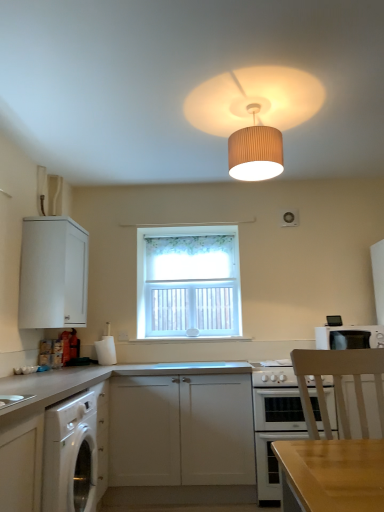
Where is `blank area beneath white glossy exhaust hood at upper center (from a real-world perspective)`? The width and height of the screenshot is (384, 512). blank area beneath white glossy exhaust hood at upper center (from a real-world perspective) is located at coordinates (184, 361).